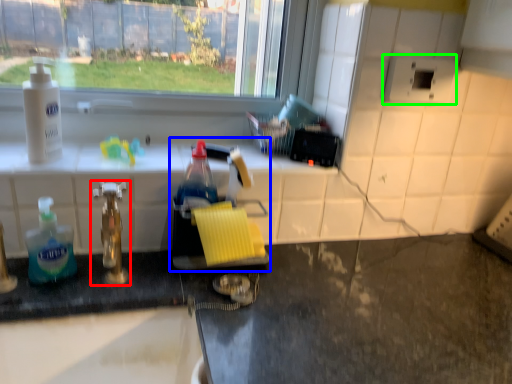
Question: Estimate the real-world distances between objects in this image. Which object is farther from tap (highlighted by a red box), sink (highlighted by a blue box) or appliance (highlighted by a green box)?

Choices:
 (A) sink
 (B) appliance

Answer: (B)